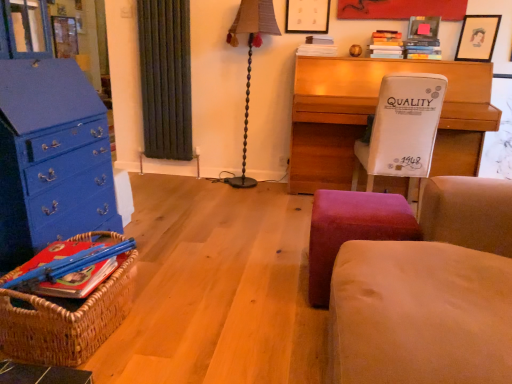
Where is `free point to the right of woven brown basket at lower left`? Image resolution: width=512 pixels, height=384 pixels. free point to the right of woven brown basket at lower left is located at coordinates (180, 321).